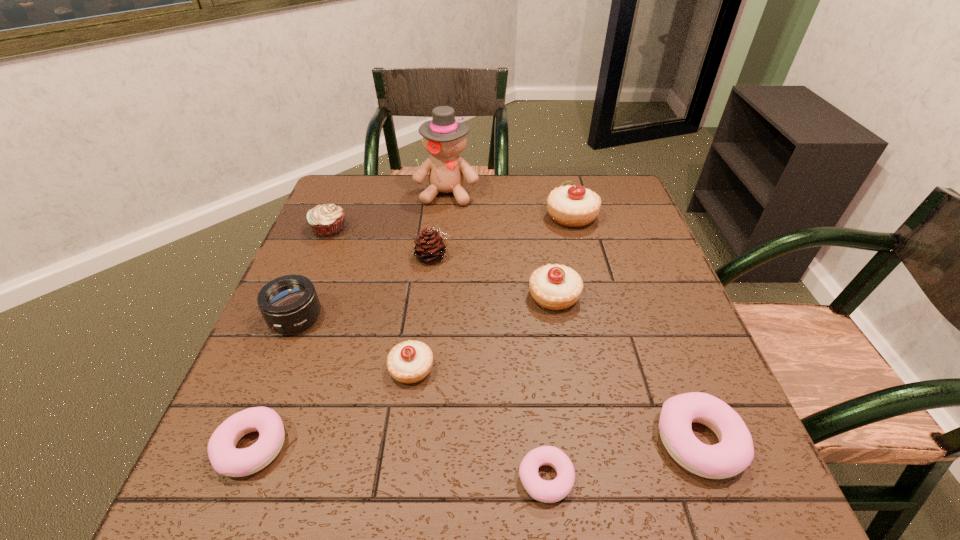
The height and width of the screenshot is (540, 960). I want to click on free space at the right edge of the desktop, so click(x=636, y=387).

In the image, there is a desktop. Find the location of `free space at the far left corner`. free space at the far left corner is located at coordinates (365, 197).

The height and width of the screenshot is (540, 960). In the image, there is a desktop. What are the coordinates of `blank space at the far right corner` in the screenshot? It's located at (592, 182).

Find the location of a particular element. The height and width of the screenshot is (540, 960). free space that is in between the second pink pastry from right to left and the pinecone is located at coordinates (490, 367).

This screenshot has height=540, width=960. I want to click on blank region between the second shortest pastry and the fourth tallest pastry, so click(475, 444).

Find the location of a particular element. The height and width of the screenshot is (540, 960). vacant area that lies between the second pink pastry from left to right and the second tallest object is located at coordinates (559, 347).

This screenshot has height=540, width=960. I want to click on vacant area that lies between the leftmost pink pastry and the second pink pastry from right to left, so click(398, 462).

Image resolution: width=960 pixels, height=540 pixels. I want to click on free spot between the seventh nearest object and the tallest object, so click(x=441, y=225).

Where is `free space between the ninth shortest object and the rightmost pink pastry`? Image resolution: width=960 pixels, height=540 pixels. free space between the ninth shortest object and the rightmost pink pastry is located at coordinates (635, 328).

Image resolution: width=960 pixels, height=540 pixels. In order to click on free space between the second pink pastry from right to left and the second tallest pastry in this screenshot , I will do `click(550, 387)`.